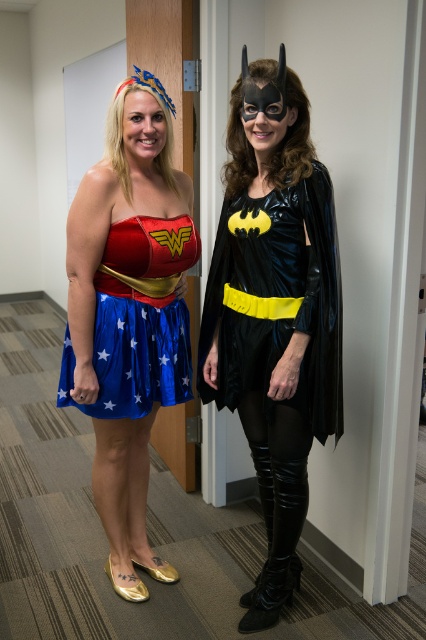
Between shiny blue skirt at center and shiny black cape at center, which one is positioned higher?

shiny black cape at center is higher up.

Is shiny blue skirt at center bigger than shiny black cape at center?

Indeed, shiny blue skirt at center has a larger size compared to shiny black cape at center.

Is point (173, 305) more distant than point (221, 401)?

That is False.

I want to click on shiny blue skirt at center, so click(129, 314).

Locate an element on the screen. Image resolution: width=426 pixels, height=640 pixels. shiny black cape at center is located at coordinates pyautogui.click(x=278, y=298).

Which is above, shiny black cape at center or blue shiny dress at center?

shiny black cape at center is above.

This screenshot has height=640, width=426. Describe the element at coordinates (278, 298) in the screenshot. I see `shiny black cape at center` at that location.

I want to click on shiny black cape at center, so click(x=278, y=298).

Between point (94, 212) and point (149, 332), which one is positioned in front?

Point (94, 212)

Who is positioned more to the left, shiny satin skirt at left or shiny blue skirt at center?

shiny blue skirt at center

Does point (270, 378) come farther from viewer compared to point (132, 362)?

No, (270, 378) is in front of (132, 362).

Find the location of a particular element. This screenshot has height=640, width=426. shiny satin skirt at left is located at coordinates (276, 314).